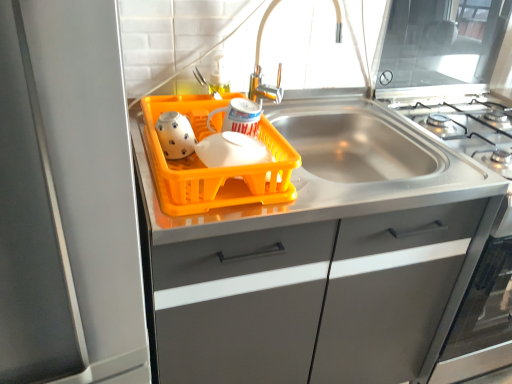
Question: Considering the relative sizes of white glossy tea pot at left, the 1th tea pot in the left-to-right sequence, and orange plastic basket at center in the image provided, is white glossy tea pot at left, the 1th tea pot in the left-to-right sequence, thinner than orange plastic basket at center?

Choices:
 (A) yes
 (B) no

Answer: (A)

Question: Is white glossy tea pot at left, which is counted as the second tea pot, starting from the right, taller than orange plastic basket at center?

Choices:
 (A) no
 (B) yes

Answer: (A)

Question: Does white glossy tea pot at left, the 1th tea pot in the left-to-right sequence, have a larger size compared to orange plastic basket at center?

Choices:
 (A) no
 (B) yes

Answer: (A)

Question: Is white glossy tea pot at left, the 1th tea pot in the left-to-right sequence, positioned beyond the bounds of orange plastic basket at center?

Choices:
 (A) yes
 (B) no

Answer: (B)

Question: From a real-world perspective, is white glossy tea pot at left, the 1th tea pot in the left-to-right sequence, physically above orange plastic basket at center?

Choices:
 (A) yes
 (B) no

Answer: (A)

Question: In terms of width, does satin silver refrigerator at left look wider or thinner when compared to matte gray cabinet at center?

Choices:
 (A) thin
 (B) wide

Answer: (B)

Question: Considering their positions, is satin silver refrigerator at left located in front of or behind matte gray cabinet at center?

Choices:
 (A) behind
 (B) front

Answer: (B)

Question: From a real-world perspective, relative to matte gray cabinet at center, is satin silver refrigerator at left vertically above or below?

Choices:
 (A) below
 (B) above

Answer: (B)

Question: In terms of height, does satin silver refrigerator at left look taller or shorter compared to matte gray cabinet at center?

Choices:
 (A) tall
 (B) short

Answer: (A)

Question: Is matte gray cabinet at center in front of or behind satin silver refrigerator at left in the image?

Choices:
 (A) front
 (B) behind

Answer: (B)

Question: From the image's perspective, is matte gray cabinet at center above or below satin silver refrigerator at left?

Choices:
 (A) below
 (B) above

Answer: (A)

Question: In terms of size, does matte gray cabinet at center appear bigger or smaller than satin silver refrigerator at left?

Choices:
 (A) small
 (B) big

Answer: (A)

Question: Visually, is matte gray cabinet at center positioned to the left or to the right of satin silver refrigerator at left?

Choices:
 (A) left
 (B) right

Answer: (B)

Question: Is white glossy tea pot at left, which is counted as the second tea pot, starting from the right, to the left or to the right of orange plastic basket at center in the image?

Choices:
 (A) right
 (B) left

Answer: (B)

Question: Does point (177, 152) appear closer or farther from the camera than point (165, 170)?

Choices:
 (A) closer
 (B) farther

Answer: (B)